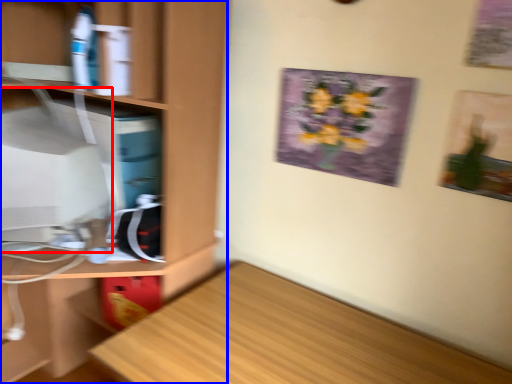
Question: Which point is closer to the camera, computer monitor (highlighted by a red box) or cabinetry (highlighted by a blue box)?

Choices:
 (A) computer monitor
 (B) cabinetry

Answer: (B)